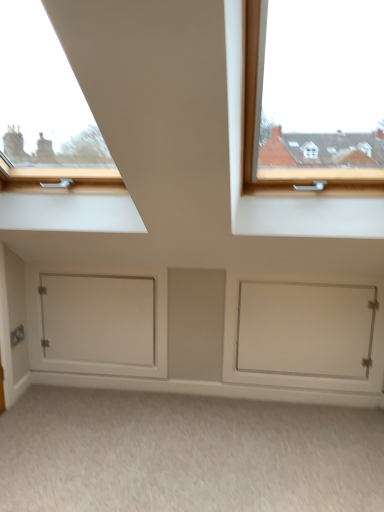
Identify the location of free space above white matte door at lower left, the first door when ordered from left to right (from a real-world perspective). This screenshot has width=384, height=512. (91, 263).